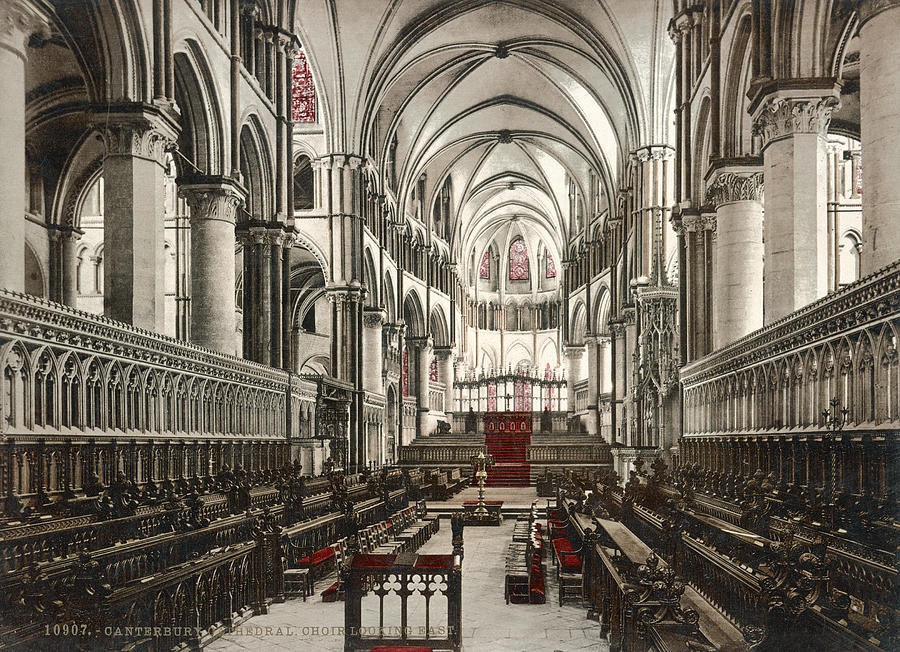
Where is `window`? Image resolution: width=900 pixels, height=652 pixels. window is located at coordinates (522, 269).